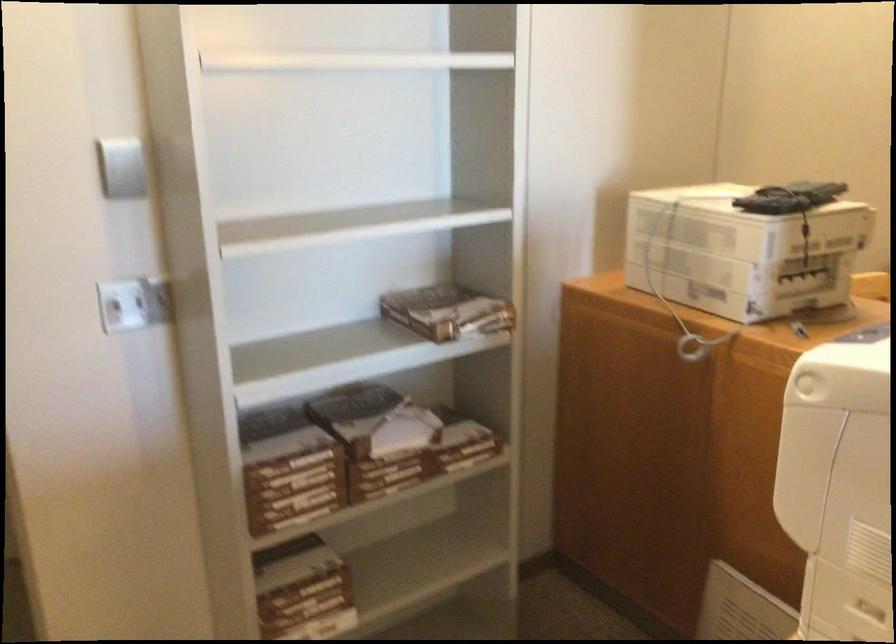
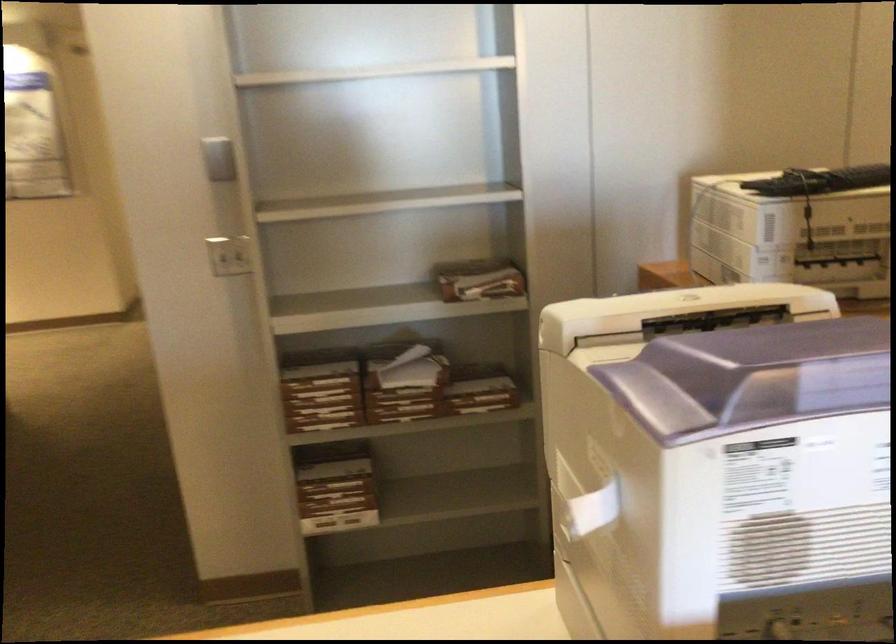
The point at (115,175) is marked in the first image. Where is the corresponding point in the second image?

(219, 158)